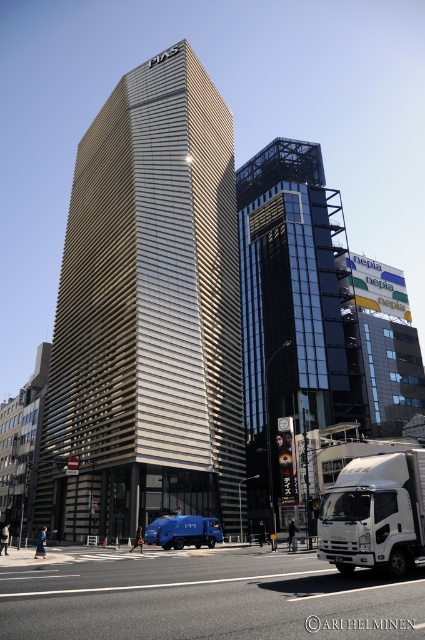
Question: Considering the relative positions of metallic silver skyscraper at center and blue matte truck at lower center in the image provided, where is metallic silver skyscraper at center located with respect to blue matte truck at lower center?

Choices:
 (A) left
 (B) right

Answer: (A)

Question: Which point appears farthest from the camera in this image?

Choices:
 (A) pos(278,317)
 (B) pos(209,529)

Answer: (A)

Question: Is metallic silver skyscraper at center positioned at the back of white glossy trailer truck at lower right?

Choices:
 (A) yes
 (B) no

Answer: (A)

Question: Is glassy steel tower at center closer to the viewer compared to blue matte truck at lower center?

Choices:
 (A) no
 (B) yes

Answer: (B)

Question: Which of the following is the farthest from the observer?

Choices:
 (A) white glossy trailer truck at lower right
 (B) glassy steel tower at center
 (C) blue matte truck at lower center
 (D) metallic silver skyscraper at center

Answer: (D)

Question: Which point is closer to the camera?

Choices:
 (A) metallic silver skyscraper at center
 (B) blue matte truck at lower center
 (C) glassy steel tower at center
 (D) white glossy trailer truck at lower right

Answer: (D)